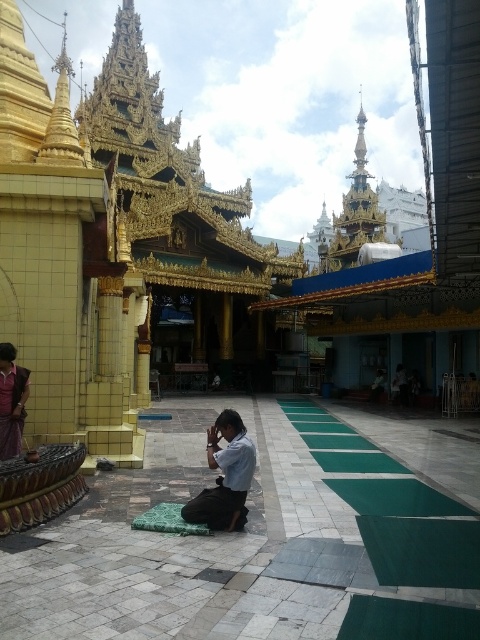
Between point (205, 493) and point (13, 355), which one is positioned in front?

Point (205, 493)

Locate an element on the screen. light blue fabric at center is located at coordinates (225, 476).

Is point (238, 448) farther from viewer compared to point (6, 397)?

No, it is in front of (6, 397).

Find the location of a particular element. Image resolution: width=480 pixels, height=640 pixels. light blue fabric at center is located at coordinates (x=225, y=476).